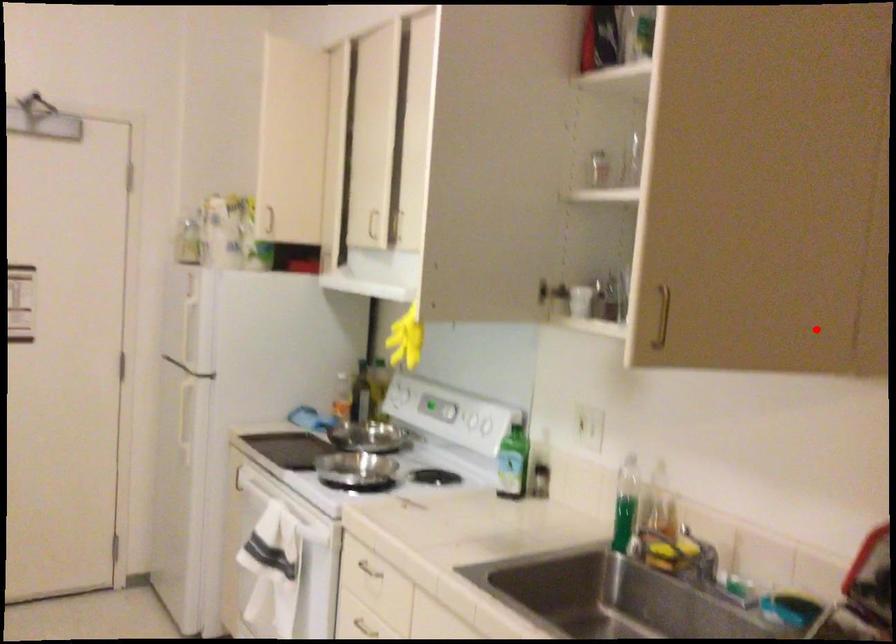
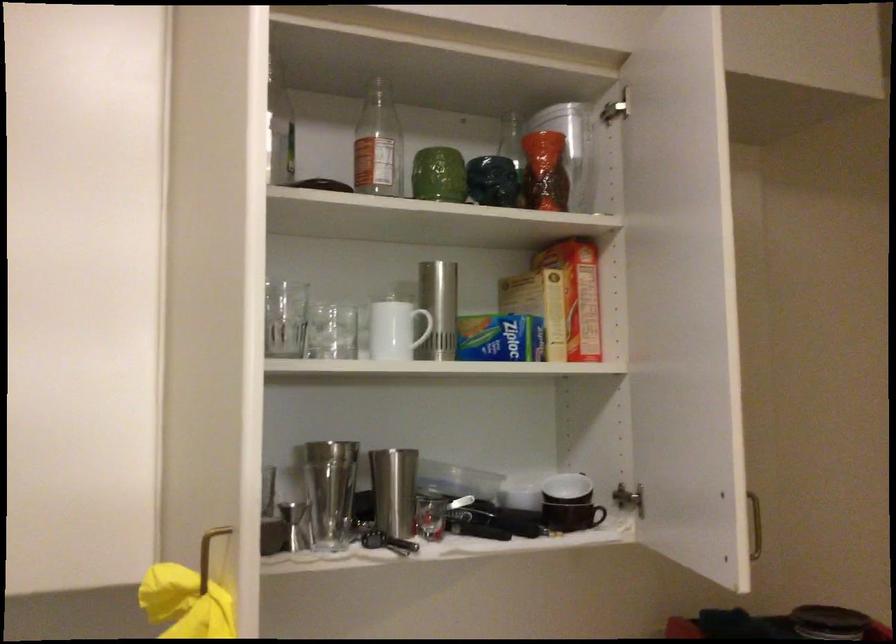
Find the pixel in the second image that matches the highlighted location in the first image.

(521, 489)